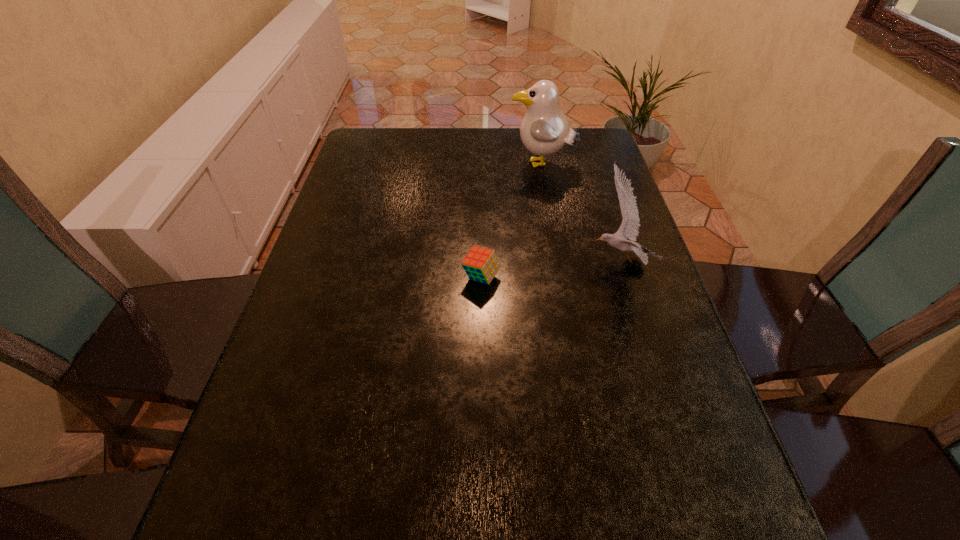
Locate an element on the screen. The image size is (960, 540). vacant space that is in between the cube and the taller gull is located at coordinates (512, 221).

The width and height of the screenshot is (960, 540). In order to click on free space that is in between the leftmost object and the farthest object in this screenshot , I will do `click(512, 221)`.

Locate an element on the screen. This screenshot has width=960, height=540. unoccupied position between the cube and the shorter gull is located at coordinates (550, 269).

Identify the location of vacant space that's between the taller gull and the shorter gull. The width and height of the screenshot is (960, 540). (580, 213).

Where is `vacant point located between the leftmost object and the tallest object`? vacant point located between the leftmost object and the tallest object is located at coordinates (512, 221).

Where is `empty space between the taller gull and the shorter gull`? The width and height of the screenshot is (960, 540). empty space between the taller gull and the shorter gull is located at coordinates (580, 213).

Locate an element on the screen. Image resolution: width=960 pixels, height=540 pixels. free space between the cube and the tallest object is located at coordinates (512, 221).

Image resolution: width=960 pixels, height=540 pixels. Identify the location of vacant area that lies between the leftmost object and the farther gull. (512, 221).

Image resolution: width=960 pixels, height=540 pixels. I want to click on the closest object to the second shortest object, so click(544, 130).

Choose which object is the second nearest neighbor to the shortest object. Please provide its 2D coordinates. Your answer should be formatted as a tuple, i.e. [(x, y)], where the tuple contains the x and y coordinates of a point satisfying the conditions above.

[(544, 130)]